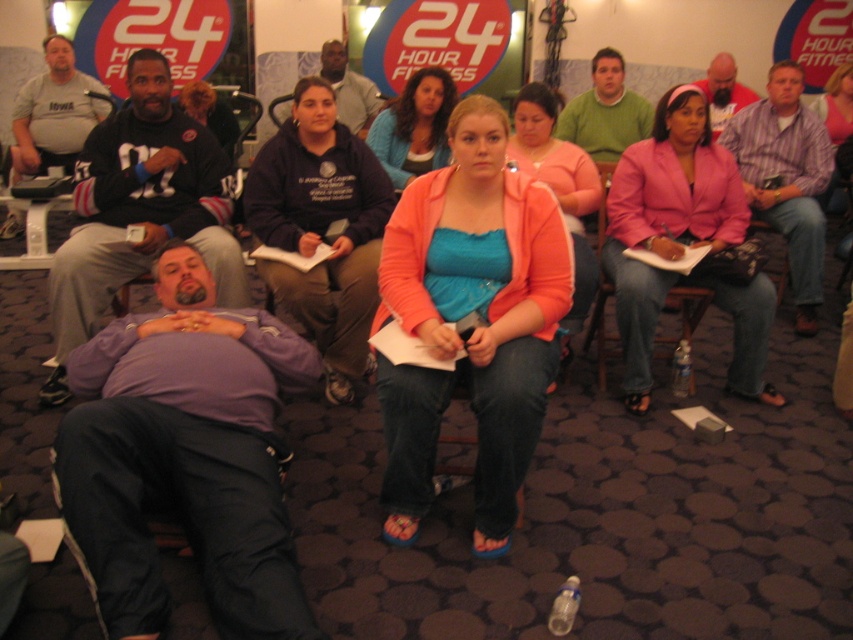
Question: In this image, where is purple fleece jacket at lower left located relative to green sweater at center?

Choices:
 (A) right
 (B) left

Answer: (B)

Question: Does striped cotton shirt at center have a lesser width compared to matte gray sweatshirt at center?

Choices:
 (A) yes
 (B) no

Answer: (A)

Question: Among these points, which one is farthest from the camera?

Choices:
 (A) (68, 76)
 (B) (337, 157)
 (C) (210, 90)
 (D) (479, 547)

Answer: (C)

Question: Is blue fabric shirt at center closer to the viewer compared to matte black hoodie at center?

Choices:
 (A) yes
 (B) no

Answer: (A)

Question: Which object is the farthest from the pink fabric jacket at center?

Choices:
 (A) green sweater at center
 (B) matte gray sweatshirt at center
 (C) purple fabric at lower left
 (D) pink fabric chair at center

Answer: (B)

Question: Which point is farther from the camera taking this photo?

Choices:
 (A) (653, 282)
 (B) (221, 195)

Answer: (B)